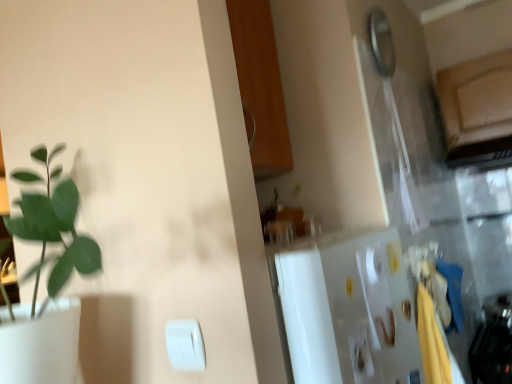
Question: From a real-world perspective, is white plastic light switch at lower center, which is counted as the 2th light switch, starting from the back, positioned above or below white plastic light switch at lower center, the second light switch positioned from the front?

Choices:
 (A) above
 (B) below

Answer: (A)

Question: Based on their positions, is white plastic light switch at lower center, marked as the first light switch in a front-to-back arrangement, located to the left or right of white plastic light switch at lower center, the second light switch positioned from the front?

Choices:
 (A) right
 (B) left

Answer: (B)

Question: Is white plastic light switch at lower center, which is counted as the 2th light switch, starting from the back, taller or shorter than white plastic light switch at lower center, the 1th light switch in the right-to-left sequence?

Choices:
 (A) short
 (B) tall

Answer: (A)

Question: Is point (356, 374) closer or farther from the camera than point (176, 360)?

Choices:
 (A) closer
 (B) farther

Answer: (B)

Question: Considering the positions of white plastic light switch at lower center, the 1th light switch in the right-to-left sequence, and white plastic light switch at lower center, placed as the second light switch when sorted from right to left, in the image, is white plastic light switch at lower center, the 1th light switch in the right-to-left sequence, wider or thinner than white plastic light switch at lower center, placed as the second light switch when sorted from right to left,?

Choices:
 (A) wide
 (B) thin

Answer: (A)

Question: Looking at the image, does white plastic light switch at lower center, which is the second light switch from left to right, seem bigger or smaller compared to white plastic light switch at lower center, placed as the 1th light switch when sorted from left to right?

Choices:
 (A) small
 (B) big

Answer: (B)

Question: Considering the positions of white plastic light switch at lower center, the second light switch positioned from the front, and white plastic light switch at lower center, marked as the first light switch in a front-to-back arrangement, in the image, is white plastic light switch at lower center, the second light switch positioned from the front, taller or shorter than white plastic light switch at lower center, marked as the first light switch in a front-to-back arrangement,?

Choices:
 (A) tall
 (B) short

Answer: (A)